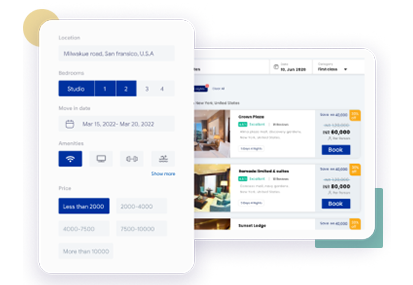
Locate an element on the screen. pictures of hotel rooms is located at coordinates (215, 129), (211, 185), (207, 215), (194, 239).